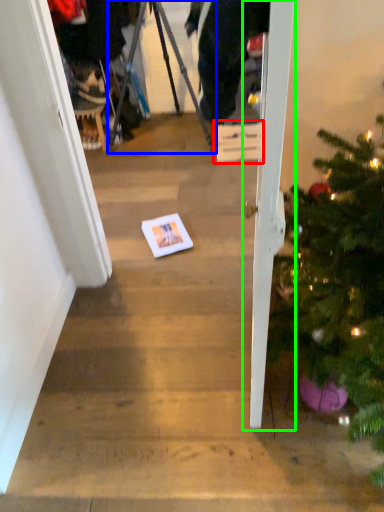
Question: Which is farther away from cardboard box (highlighted by a red box)? tripod (highlighted by a blue box) or door (highlighted by a green box)?

Choices:
 (A) tripod
 (B) door

Answer: (B)